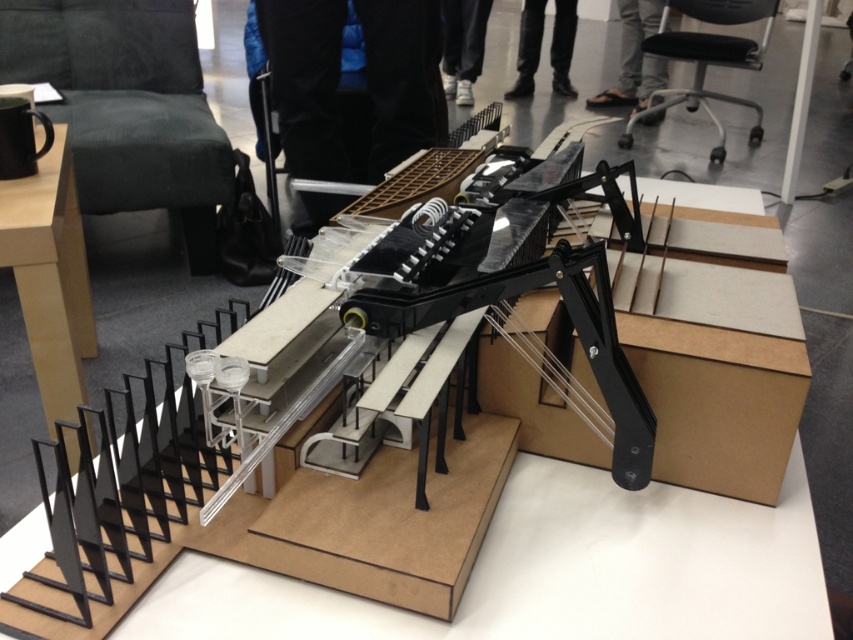
You are looking at the model displayed on the table. Where is the black fabric pants at center located in terms of its 2D coordinates?

The black fabric pants at center is located at the 2D coordinates point [366,84].

You are a tailor examining two pairs of pants in the image. The black fabric pants at center and the white fabric pants at center. Which pair is shorter in height?

The black fabric pants at center has a lesser height compared to white fabric pants at center, so the black fabric pants at center is shorter in height.

You are an observer looking at the model structure. The black fabric pants at center and the black leather pants at upper center are part of the model. Which of these two items is bigger in size?

The black fabric pants at center is larger in size than the black leather pants at upper center.